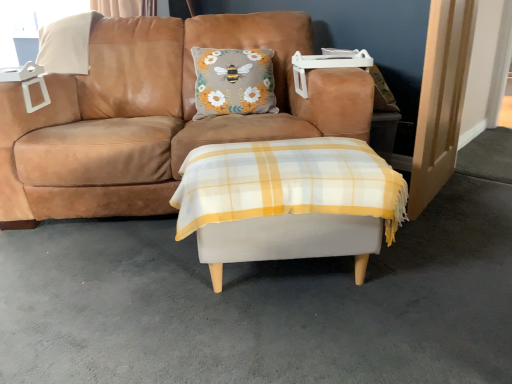
Question: Considering the relative sizes of white plastic window screen at upper left and white fabric ottoman at center in the image provided, is white plastic window screen at upper left wider than white fabric ottoman at center?

Choices:
 (A) yes
 (B) no

Answer: (B)

Question: From a real-world perspective, is white plastic window screen at upper left under white fabric ottoman at center?

Choices:
 (A) no
 (B) yes

Answer: (A)

Question: Can you confirm if white plastic window screen at upper left is taller than white fabric ottoman at center?

Choices:
 (A) no
 (B) yes

Answer: (B)

Question: From a real-world perspective, is white plastic window screen at upper left located higher than white fabric ottoman at center?

Choices:
 (A) yes
 (B) no

Answer: (A)

Question: Is white plastic window screen at upper left closer to the viewer compared to white fabric ottoman at center?

Choices:
 (A) yes
 (B) no

Answer: (B)

Question: In terms of height, does white fabric ottoman at center look taller or shorter compared to light wood door at right?

Choices:
 (A) short
 (B) tall

Answer: (A)

Question: From the image's perspective, is white fabric ottoman at center positioned above or below light wood door at right?

Choices:
 (A) above
 (B) below

Answer: (B)

Question: From a real-world perspective, is white fabric ottoman at center physically located above or below light wood door at right?

Choices:
 (A) above
 (B) below

Answer: (B)

Question: Is point (393, 195) closer or farther from the camera than point (460, 1)?

Choices:
 (A) closer
 (B) farther

Answer: (A)

Question: Relative to white fabric ottoman at center, is white plastic window screen at upper left in front or behind?

Choices:
 (A) front
 (B) behind

Answer: (B)

Question: From a real-world perspective, relative to white fabric ottoman at center, is white plastic window screen at upper left vertically above or below?

Choices:
 (A) above
 (B) below

Answer: (A)

Question: In terms of size, does white plastic window screen at upper left appear bigger or smaller than white fabric ottoman at center?

Choices:
 (A) big
 (B) small

Answer: (B)

Question: Do you think white plastic window screen at upper left is within white fabric ottoman at center, or outside of it?

Choices:
 (A) inside
 (B) outside

Answer: (B)

Question: From a real-world perspective, relative to white plastic window screen at upper left, is suede tan couch at center vertically above or below?

Choices:
 (A) above
 (B) below

Answer: (B)

Question: Considering the relative positions of suede tan couch at center and white plastic window screen at upper left in the image provided, is suede tan couch at center to the left or to the right of white plastic window screen at upper left?

Choices:
 (A) left
 (B) right

Answer: (B)